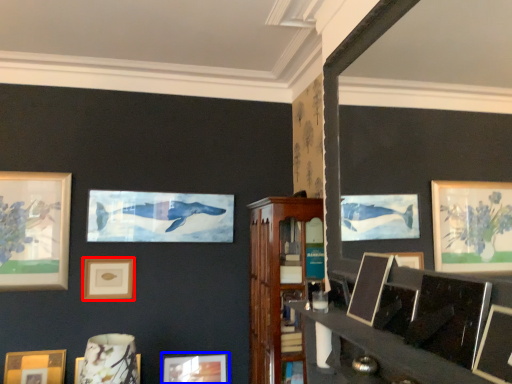
Question: Which point is further to the camera, picture frame (highlighted by a red box) or picture frame (highlighted by a blue box)?

Choices:
 (A) picture frame
 (B) picture frame

Answer: (A)